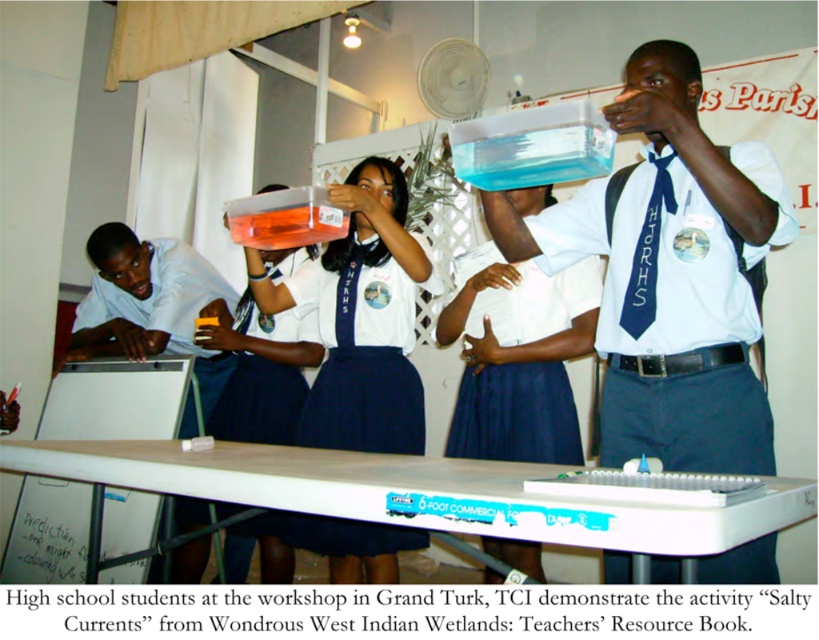
You are a photographer trying to capture a clear photo of the student in the white fabric shirt at center. Since the white fabric shirt at upper center is blocking your view, can you move closer to the table to get a better shot?

The white fabric shirt at upper center has a larger size compared to white fabric shirt at center, so moving closer to the table might help you avoid the obstruction caused by the larger shirt at upper center, allowing you to see the student in the white fabric shirt at center more clearly.